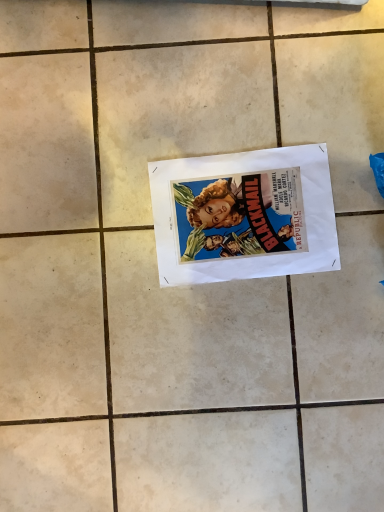
This screenshot has height=512, width=384. What do you see at coordinates (244, 214) in the screenshot? I see `matte paper poster at center` at bounding box center [244, 214].

Where is `matte paper poster at center`? matte paper poster at center is located at coordinates (244, 214).

Identify the location of matte paper poster at center. (244, 214).